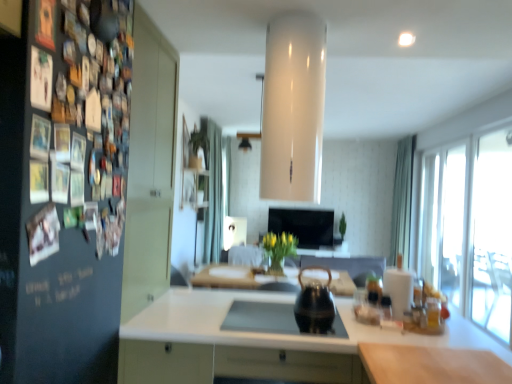
Question: Considering the relative sizes of green fabric curtain at right, the first curtain in the right-to-left sequence, and black glossy tv at center in the image provided, is green fabric curtain at right, the first curtain in the right-to-left sequence, bigger than black glossy tv at center?

Choices:
 (A) no
 (B) yes

Answer: (B)

Question: From a real-world perspective, is green fabric curtain at right, the first curtain in the right-to-left sequence, located beneath black glossy tv at center?

Choices:
 (A) yes
 (B) no

Answer: (B)

Question: Is green fabric curtain at right, the first curtain in the right-to-left sequence, not within black glossy tv at center?

Choices:
 (A) no
 (B) yes

Answer: (B)

Question: Is green fabric curtain at right, the first curtain in the right-to-left sequence, at the left side of black glossy tv at center?

Choices:
 (A) yes
 (B) no

Answer: (B)

Question: Is green fabric curtain at right, the first curtain in the right-to-left sequence, not near black glossy tv at center?

Choices:
 (A) no
 (B) yes

Answer: (B)

Question: Is green fabric curtain at right, acting as the second curtain starting from the left, at the right side of black glossy tv at center?

Choices:
 (A) no
 (B) yes

Answer: (B)

Question: From a real-world perspective, is black glass sink at center beneath dark matte board at left?

Choices:
 (A) no
 (B) yes

Answer: (B)

Question: Could you tell me if black glass sink at center is facing dark matte board at left?

Choices:
 (A) yes
 (B) no

Answer: (B)

Question: Is black glass sink at center shorter than dark matte board at left?

Choices:
 (A) yes
 (B) no

Answer: (A)

Question: Are black glass sink at center and dark matte board at left located far from each other?

Choices:
 (A) yes
 (B) no

Answer: (B)

Question: From the image's perspective, is black glass sink at center on dark matte board at left?

Choices:
 (A) yes
 (B) no

Answer: (B)

Question: Would you say dark matte board at left is part of black glass sink at center's contents?

Choices:
 (A) no
 (B) yes

Answer: (A)

Question: Considering the relative sizes of dark matte board at left and white glossy countertop at center, the second countertop positioned from the right, in the image provided, is dark matte board at left shorter than white glossy countertop at center, the second countertop positioned from the right,?

Choices:
 (A) yes
 (B) no

Answer: (B)